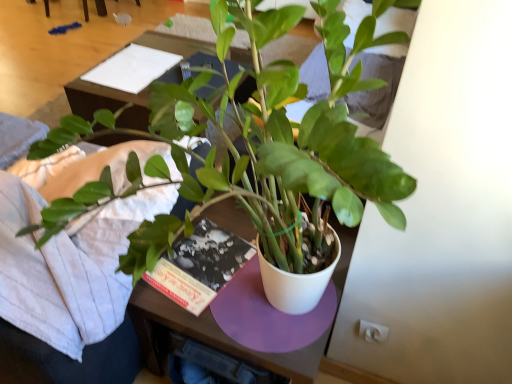
Question: Considering the relative sizes of white paper at upper center and green matte plant at center in the image provided, is white paper at upper center bigger than green matte plant at center?

Choices:
 (A) yes
 (B) no

Answer: (B)

Question: Is white paper at upper center taller than green matte plant at center?

Choices:
 (A) no
 (B) yes

Answer: (A)

Question: Is white paper at upper center shorter than green matte plant at center?

Choices:
 (A) no
 (B) yes

Answer: (B)

Question: Does white paper at upper center come in front of green matte plant at center?

Choices:
 (A) yes
 (B) no

Answer: (B)

Question: Are white paper at upper center and green matte plant at center located far from each other?

Choices:
 (A) no
 (B) yes

Answer: (B)

Question: From the image's perspective, is white paper at upper center beneath green matte plant at center?

Choices:
 (A) no
 (B) yes

Answer: (A)

Question: Is wooden table at center outside white paper at upper center?

Choices:
 (A) yes
 (B) no

Answer: (A)

Question: Is wooden table at center smaller than white paper at upper center?

Choices:
 (A) no
 (B) yes

Answer: (A)

Question: Is wooden table at center wider than white paper at upper center?

Choices:
 (A) no
 (B) yes

Answer: (B)

Question: From the image's perspective, does wooden table at center appear higher than white paper at upper center?

Choices:
 (A) no
 (B) yes

Answer: (A)

Question: Does wooden table at center have a lesser width compared to white paper at upper center?

Choices:
 (A) yes
 (B) no

Answer: (B)

Question: From a real-world perspective, is wooden table at center below white paper at upper center?

Choices:
 (A) yes
 (B) no

Answer: (A)

Question: Can you confirm if green matte plant at center is thinner than wooden table at center?

Choices:
 (A) no
 (B) yes

Answer: (A)